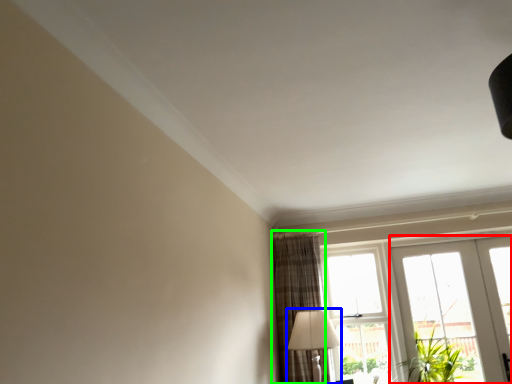
Question: Estimate the real-world distances between objects in this image. Which object is farther from door (highlighted by a red box), table lamp (highlighted by a blue box) or curtain (highlighted by a green box)?

Choices:
 (A) table lamp
 (B) curtain

Answer: (A)